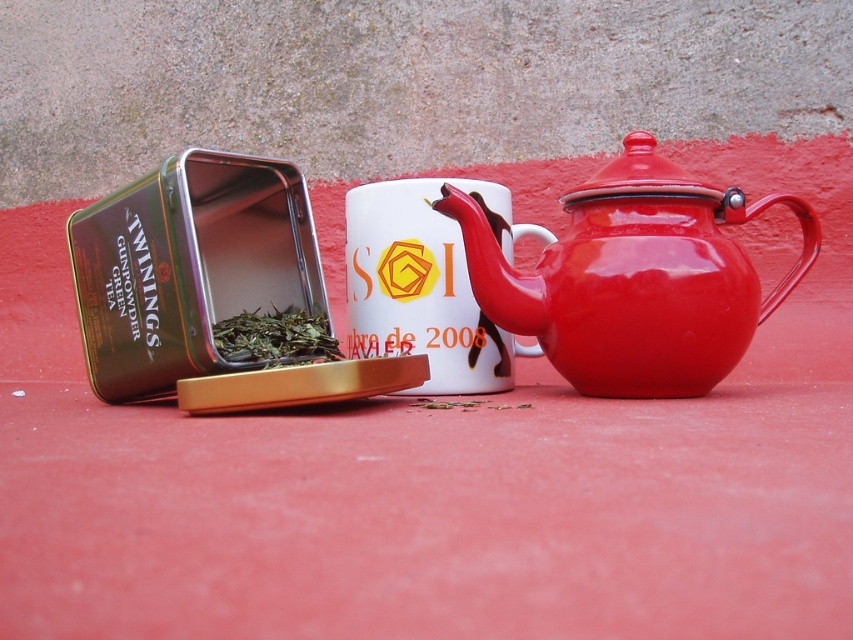
Question: Does shiny enamel teapot at center right have a larger size compared to white glossy mug at center?

Choices:
 (A) yes
 (B) no

Answer: (A)

Question: Estimate the real-world distances between objects in this image. Which object is farther from the glossy enamel teapot at center?

Choices:
 (A) white glossy mug at center
 (B) shiny enamel teapot at center right

Answer: (A)

Question: Which is nearer to the glossy enamel teapot at center?

Choices:
 (A) white glossy mug at center
 (B) shiny enamel teapot at center right

Answer: (B)

Question: Which of the following is the farthest from the observer?

Choices:
 (A) glossy enamel teapot at center
 (B) shiny enamel teapot at center right

Answer: (A)

Question: Is glossy enamel teapot at center above white glossy mug at center?

Choices:
 (A) yes
 (B) no

Answer: (A)

Question: Does shiny enamel teapot at center right have a greater width compared to white glossy mug at center?

Choices:
 (A) no
 (B) yes

Answer: (B)